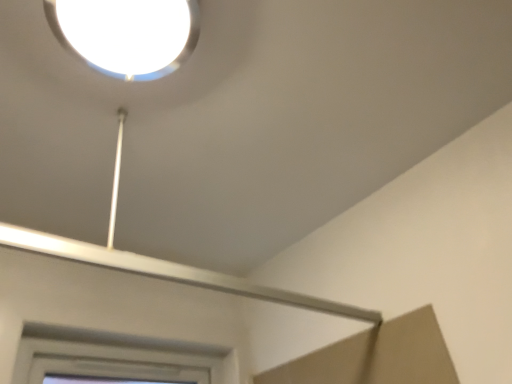
Describe the element at coordinates (127, 34) in the screenshot. Image resolution: width=512 pixels, height=384 pixels. I see `white glossy light fixture at upper center` at that location.

Where is `white glossy light fixture at upper center`? Image resolution: width=512 pixels, height=384 pixels. white glossy light fixture at upper center is located at coordinates (127, 34).

You are a GUI agent. You are given a task and a screenshot of the screen. Output one action in this format:
    pyautogui.click(x=<x>, y=<y>)
    Task: Click on the white glossy light fixture at upper center
    
    Given the screenshot: What is the action you would take?
    pyautogui.click(x=127, y=34)